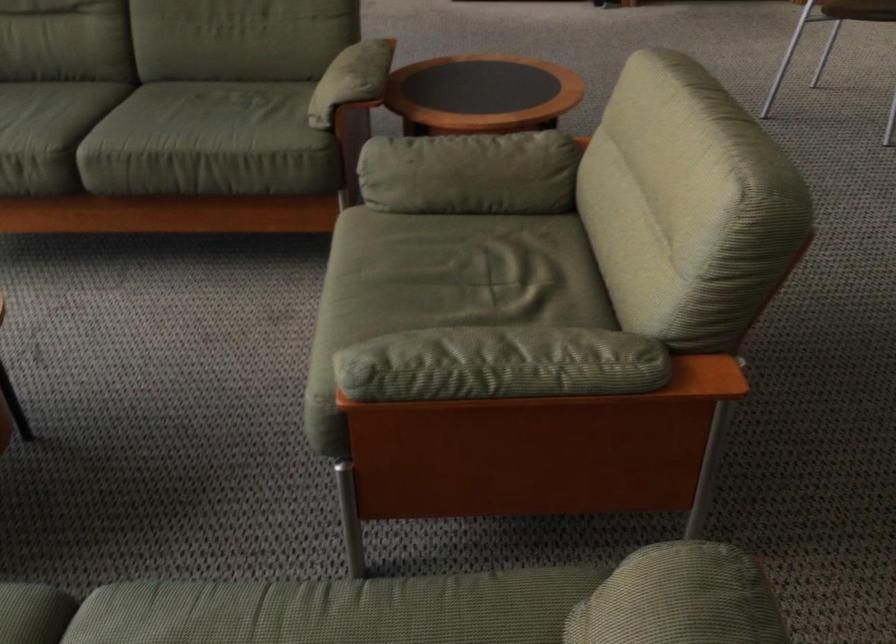
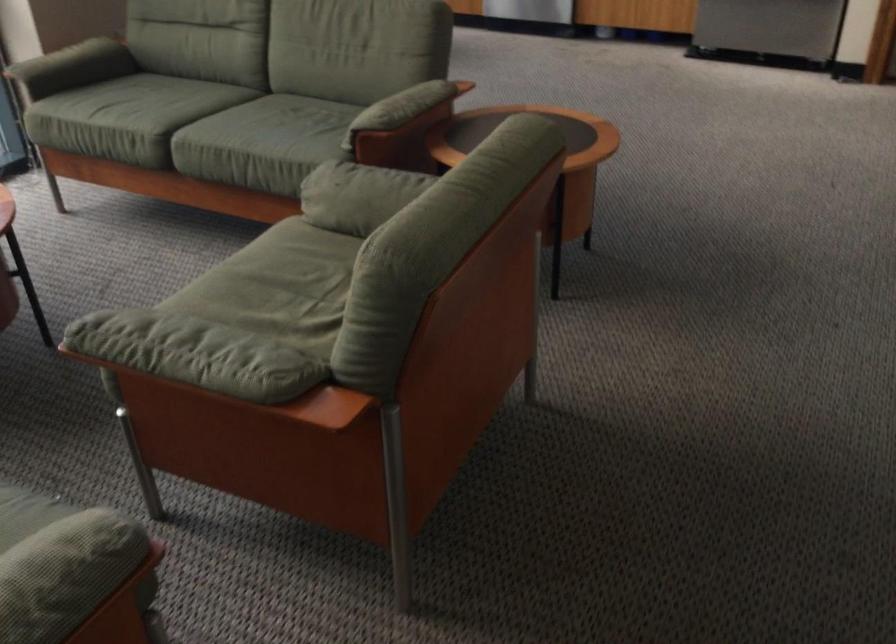
The point at [437,147] is marked in the first image. Where is the corresponding point in the second image?

(364, 176)